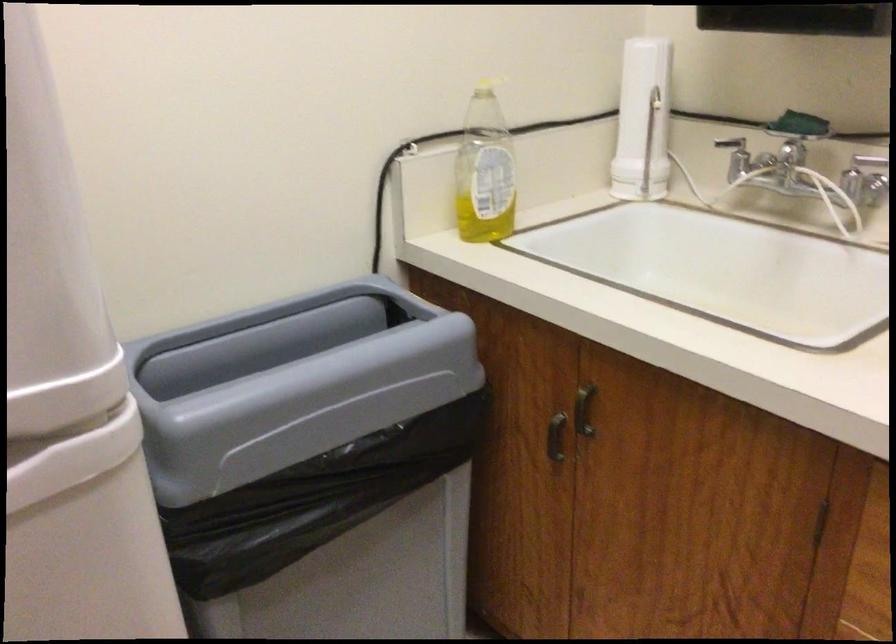
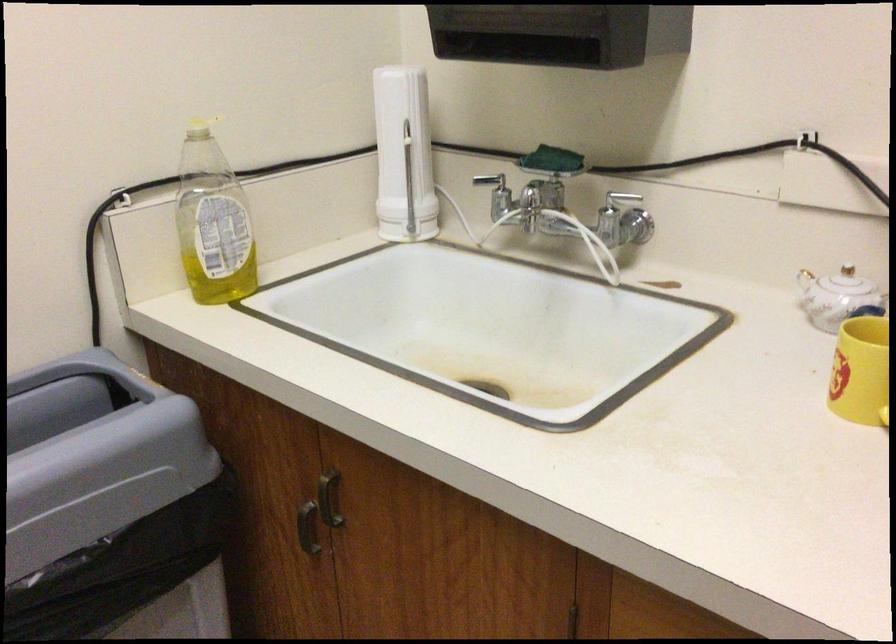
Find the pixel in the second image that matches [586,409] in the first image.

(328, 498)